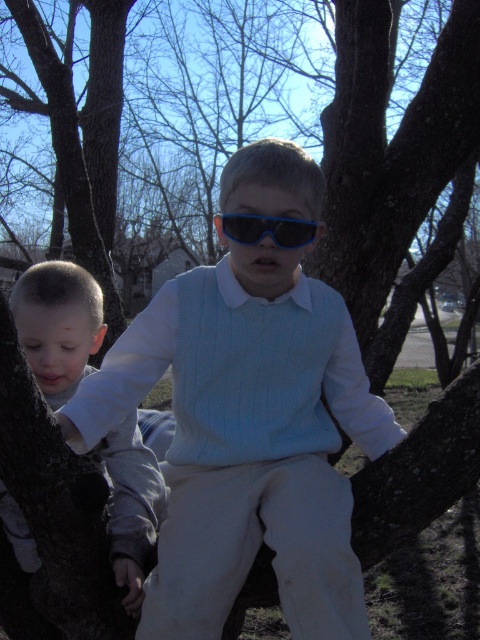
Question: Is light gray fleece shirt at left above blue plastic goggles at center?

Choices:
 (A) yes
 (B) no

Answer: (B)

Question: Which is farther from the blue plastic sunglasses at center?

Choices:
 (A) light gray fleece shirt at left
 (B) blue plastic goggles at center

Answer: (B)

Question: Among these points, which one is nearest to the camera?

Choices:
 (A) (35, 552)
 (B) (141, 332)
 (C) (259, 236)

Answer: (C)

Question: Which point appears farthest from the camera in this image?

Choices:
 (A) (236, 236)
 (B) (264, 452)

Answer: (B)

Question: Is blue plastic sunglasses at center further to the viewer compared to blue plastic goggles at center?

Choices:
 (A) yes
 (B) no

Answer: (B)

Question: Can you confirm if light gray fleece shirt at left is positioned to the left of blue plastic goggles at center?

Choices:
 (A) yes
 (B) no

Answer: (A)